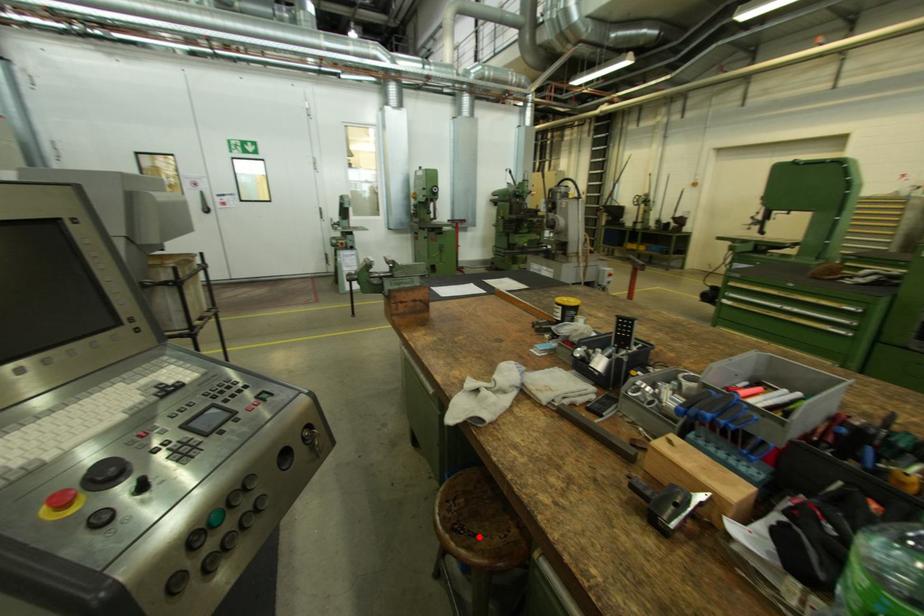
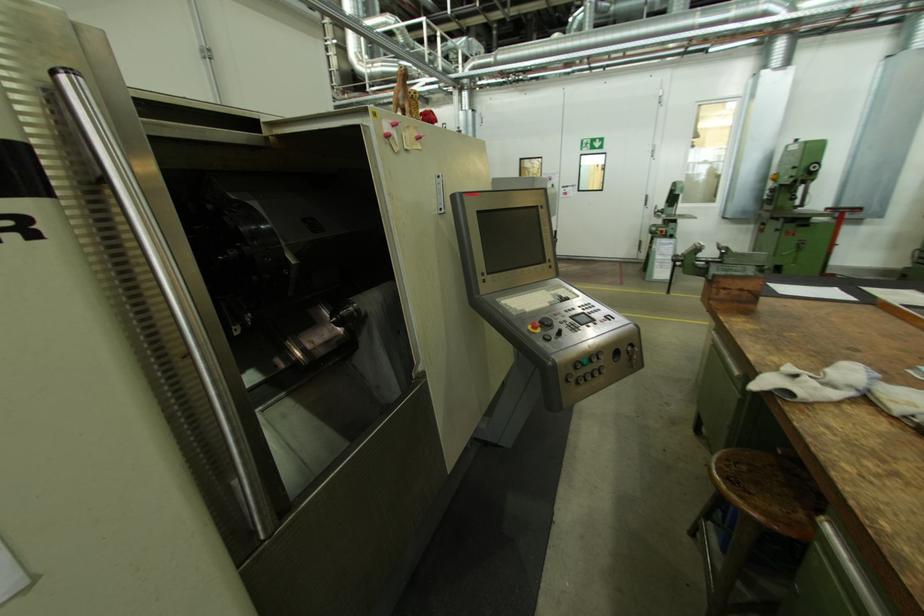
Where in the second image is the point corresponding to the highlighted location from the first image?

(755, 493)